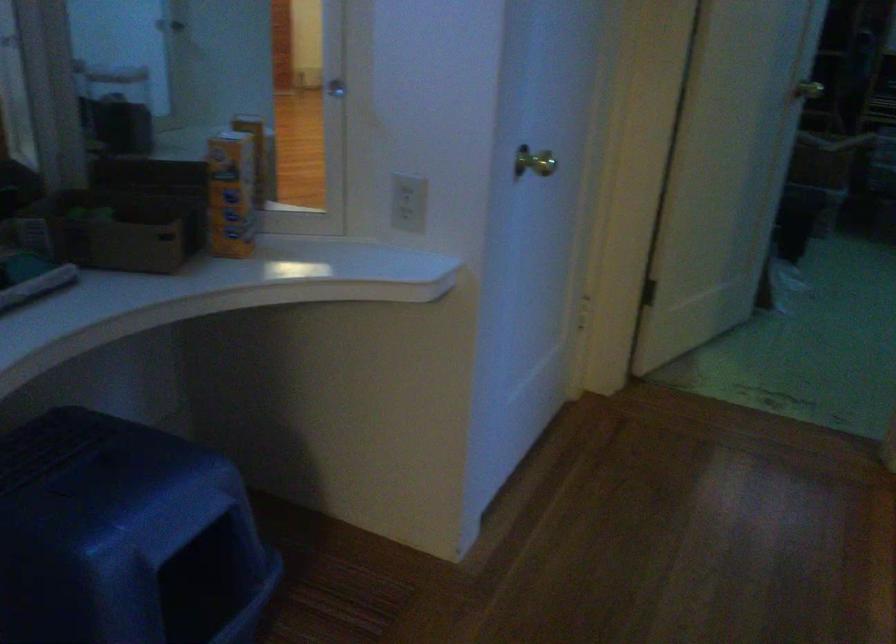
Locate an element on the screen. blue litter box is located at coordinates (124, 536).